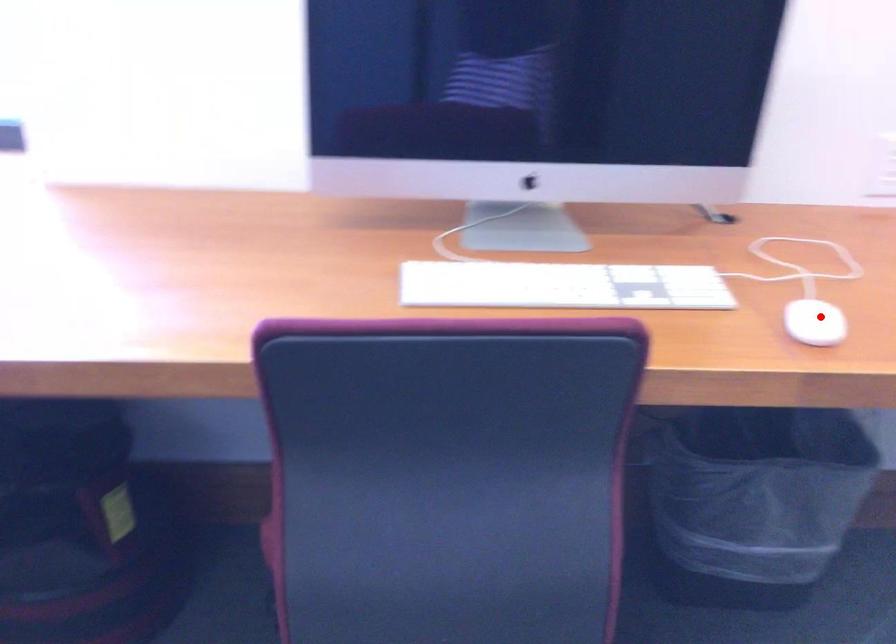
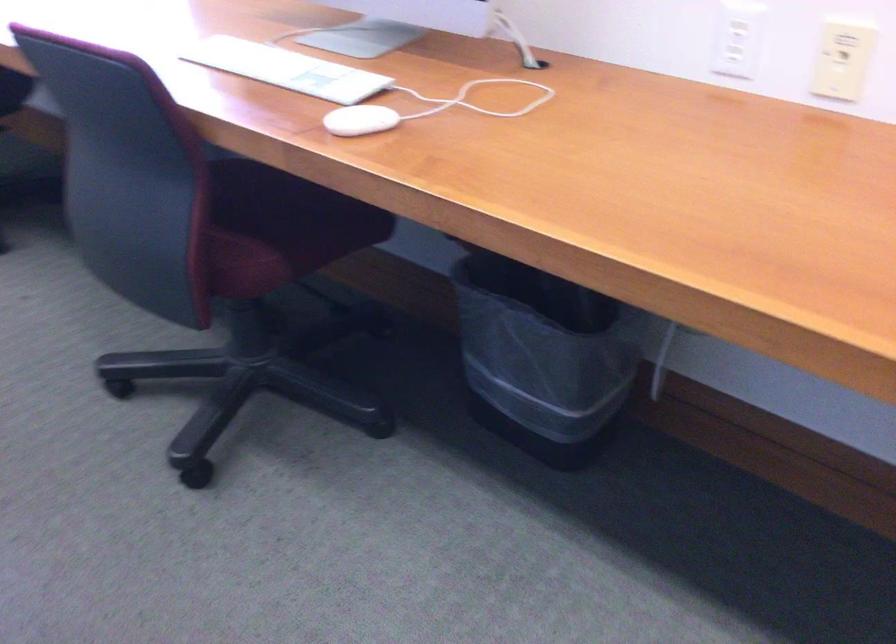
Locate, in the second image, the point that corresponds to the highlighted location in the first image.

(359, 120)